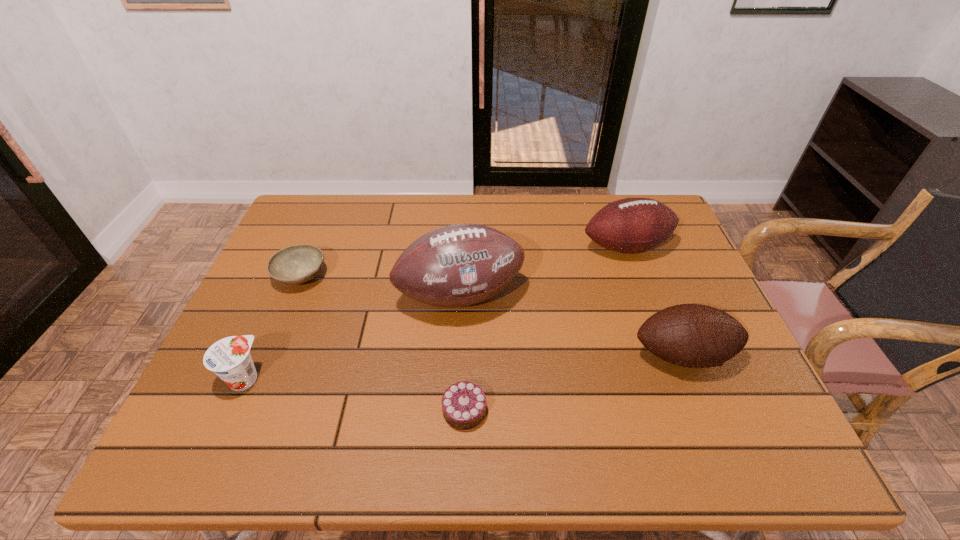
The height and width of the screenshot is (540, 960). Find the location of `free region at the left edge of the desktop`. free region at the left edge of the desktop is located at coordinates (263, 397).

Identify the location of vacant space at the right edge of the desktop. This screenshot has width=960, height=540. (660, 258).

Find the location of a particular element. The width and height of the screenshot is (960, 540). vacant area at the far right corner is located at coordinates (660, 198).

Locate an element on the screen. This screenshot has width=960, height=540. unoccupied position between the nearest football and the farthest football is located at coordinates (655, 301).

This screenshot has width=960, height=540. In order to click on free area in between the leftmost football and the third shortest object in this screenshot , I will do `click(352, 338)`.

Find the location of a particular element. empty location between the chocolate cake and the bowl is located at coordinates (382, 343).

At what (x,y) coordinates should I click in order to perform the action: click on free spot between the yogurt and the bowl. Please return your answer as a coordinate pair (x, y). The width and height of the screenshot is (960, 540). Looking at the image, I should click on (272, 327).

At what (x,y) coordinates should I click in order to perform the action: click on free space between the third shortest object and the chocolate cake. Please return your answer as a coordinate pair (x, y). Image resolution: width=960 pixels, height=540 pixels. Looking at the image, I should click on (354, 395).

Identify the location of free area in between the leftmost football and the bowl. (380, 286).

At what (x,y) coordinates should I click in order to perform the action: click on empty location between the chocolate cake and the bowl. Please return your answer as a coordinate pair (x, y). The height and width of the screenshot is (540, 960). Looking at the image, I should click on (382, 343).